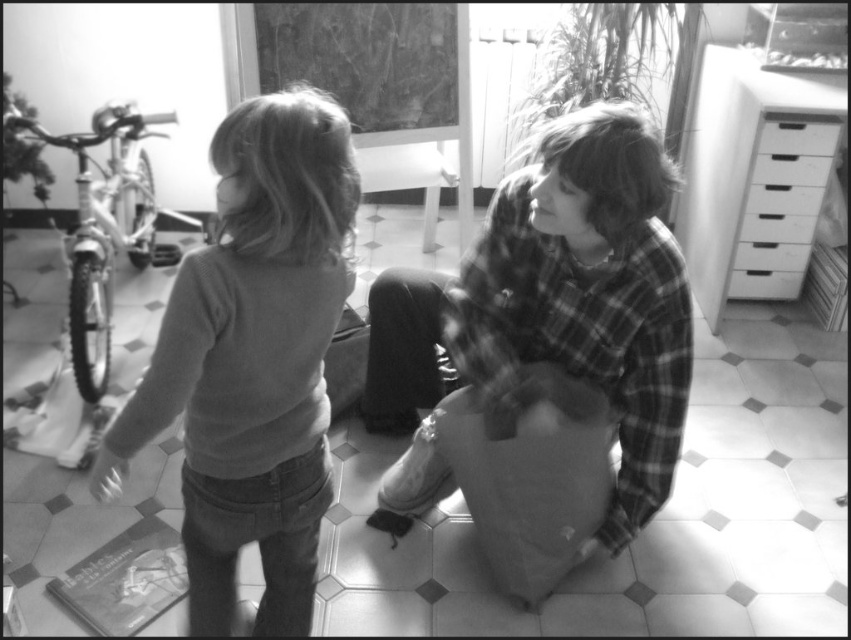
Identify the location of flannel shirt at center. (558, 301).

In the scene shown: Is flannel shirt at center behind white plastic dresser at upper right?

That is False.

Does point (409, 502) lie behind point (695, 250)?

No, (409, 502) is in front of (695, 250).

Where is `flannel shirt at center`? The image size is (851, 640). flannel shirt at center is located at coordinates (558, 301).

Can you confirm if smooth gray sweater at center is taller than white plastic drawers at right?

Correct, smooth gray sweater at center is much taller as white plastic drawers at right.

Does point (273, 513) come behind point (785, 168)?

No.

The height and width of the screenshot is (640, 851). Find the location of `smooth gray sweater at center`. smooth gray sweater at center is located at coordinates (253, 360).

Measure the distance between point [604,260] and camera.

Point [604,260] is 5.60 feet from camera.

Can you confirm if flannel shirt at center is shorter than white plastic drawer at upper right?

In fact, flannel shirt at center may be taller than white plastic drawer at upper right.

Who is more forward, (423, 346) or (830, 140)?

Positioned in front is point (423, 346).

Identify the location of flannel shirt at center. (558, 301).